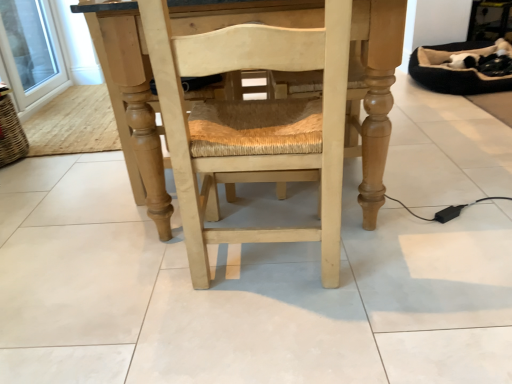
The image size is (512, 384). What do you see at coordinates (253, 124) in the screenshot?
I see `light wood chair at center` at bounding box center [253, 124].

Find the location of a particular element. light wood chair at center is located at coordinates (253, 124).

What do you see at coordinates (30, 50) in the screenshot? I see `transparent glass door at upper left` at bounding box center [30, 50].

This screenshot has height=384, width=512. I want to click on transparent glass door at upper left, so click(x=30, y=50).

The image size is (512, 384). Find the location of `light wood chair at center`. light wood chair at center is located at coordinates (x=253, y=124).

Which is more to the left, transparent glass door at upper left or light wood chair at center?

From the viewer's perspective, transparent glass door at upper left appears more on the left side.

Is transparent glass door at upper left further to camera compared to light wood chair at center?

That is True.

Which is closer, (0, 31) or (159, 95)?

Point (0, 31) is farther from the camera than point (159, 95).

From the image's perspective, which one is positioned higher, transparent glass door at upper left or light wood chair at center?

transparent glass door at upper left, from the image's perspective.

From a real-world perspective, is transparent glass door at upper left positioned above or below light wood chair at center?

In terms of real-world spatial position, transparent glass door at upper left is above light wood chair at center.

Considering the relative sizes of transparent glass door at upper left and light wood chair at center in the image provided, is transparent glass door at upper left wider than light wood chair at center?

No, transparent glass door at upper left is not wider than light wood chair at center.

Considering the sizes of objects transparent glass door at upper left and light wood chair at center in the image provided, who is taller, transparent glass door at upper left or light wood chair at center?

light wood chair at center is taller.

Considering the sizes of transparent glass door at upper left and light wood chair at center in the image, is transparent glass door at upper left bigger or smaller than light wood chair at center?

transparent glass door at upper left is smaller than light wood chair at center.

Would you say transparent glass door at upper left is inside or outside light wood chair at center?

transparent glass door at upper left is spatially situated outside light wood chair at center.

Is transparent glass door at upper left far from light wood chair at center?

transparent glass door at upper left is positioned a significant distance from light wood chair at center.

Is transparent glass door at upper left looking in the opposite direction of light wood chair at center?

No, transparent glass door at upper left is not facing away from light wood chair at center.

Looking at this image, can you tell me how much transparent glass door at upper left and light wood chair at center differ in facing direction?

The angle between the facing direction of transparent glass door at upper left and the facing direction of light wood chair at center is 86.6 degrees.

Find the location of a particular element. The image size is (512, 384). chair in front of the transparent glass door at upper left is located at coordinates (253, 124).

Is light wood chair at center at the right side of transparent glass door at upper left?

Yes.

Based on the photo, is light wood chair at center positioned in front of transparent glass door at upper left?

Yes, light wood chair at center is closer to the camera.

Which is in front, point (331, 142) or point (25, 68)?

Positioned in front is point (331, 142).

From the image's perspective, is light wood chair at center above or below transparent glass door at upper left?

Based on their image positions, light wood chair at center is located beneath transparent glass door at upper left.

From a real-world perspective, is light wood chair at center physically above transparent glass door at upper left?

Actually, light wood chair at center is physically below transparent glass door at upper left in the real world.

Based on the photo, which of these two, light wood chair at center or transparent glass door at upper left, is thinner?

transparent glass door at upper left.

Which of these two, light wood chair at center or transparent glass door at upper left, stands shorter?

Standing shorter between the two is transparent glass door at upper left.

Is light wood chair at center bigger than transparent glass door at upper left?

Correct, light wood chair at center is larger in size than transparent glass door at upper left.

Is transparent glass door at upper left completely or partially inside light wood chair at center?

That's incorrect, transparent glass door at upper left is not inside light wood chair at center.

Is light wood chair at center in contact with transparent glass door at upper left?

No, light wood chair at center is not next to transparent glass door at upper left.

Is light wood chair at center oriented towards transparent glass door at upper left?

No, light wood chair at center is not oriented towards transparent glass door at upper left.

Consider the image. What's the angular difference between light wood chair at center and transparent glass door at upper left's facing directions?

They differ by 86.6 degrees in their facing directions.

Measure the distance from light wood chair at center to transparent glass door at upper left.

light wood chair at center and transparent glass door at upper left are 8.45 feet apart.

Locate an element on the screen. window screen above the light wood chair at center (from a real-world perspective) is located at coordinates (30, 50).

The height and width of the screenshot is (384, 512). What are the coordinates of `window screen that appears behind the light wood chair at center` in the screenshot? It's located at (30, 50).

At what (x,y) coordinates should I click in order to perform the action: click on window screen above the light wood chair at center (from a real-world perspective). Please return your answer as a coordinate pair (x, y). This screenshot has width=512, height=384. Looking at the image, I should click on (30, 50).